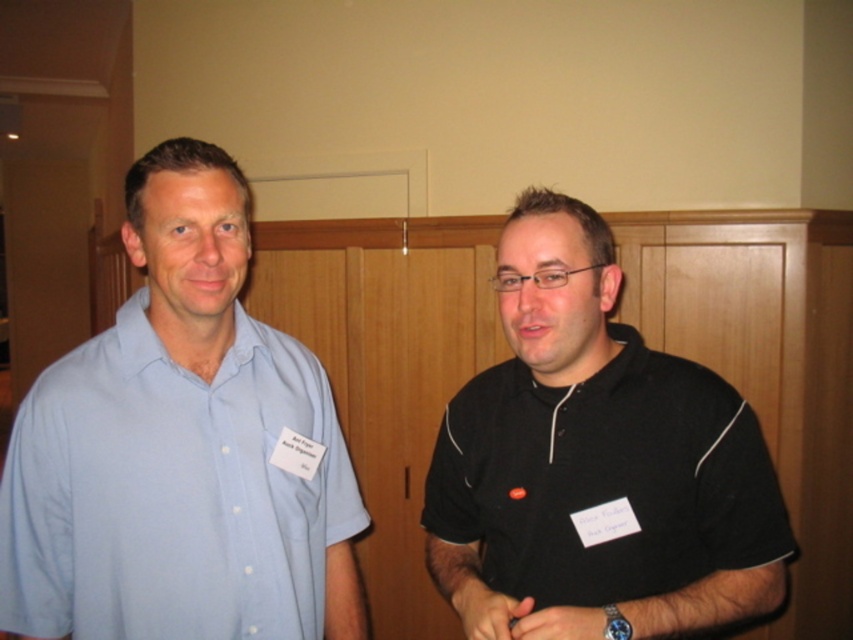
Question: Which point appears farthest from the camera in this image?

Choices:
 (A) (445, 524)
 (B) (128, 410)

Answer: (A)

Question: Is black matte shirt at right bigger than light blue cotton shirt at left?

Choices:
 (A) no
 (B) yes

Answer: (B)

Question: Is black matte shirt at right smaller than light blue cotton shirt at left?

Choices:
 (A) yes
 (B) no

Answer: (B)

Question: Which point is closer to the camera?

Choices:
 (A) black matte shirt at right
 (B) light blue cotton shirt at left

Answer: (A)

Question: Is black matte shirt at right positioned behind light blue cotton shirt at left?

Choices:
 (A) no
 (B) yes

Answer: (A)